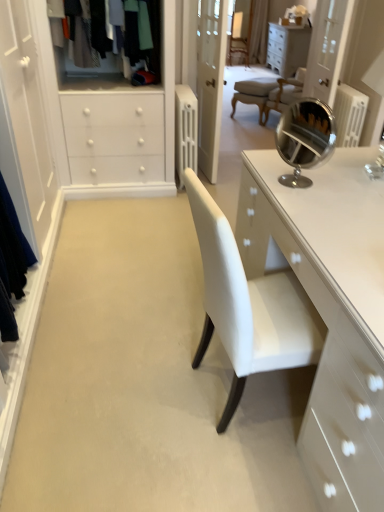
Question: Considering the positions of transparent glass door at upper right and polished chrome mirror at upper right in the image, is transparent glass door at upper right wider or thinner than polished chrome mirror at upper right?

Choices:
 (A) thin
 (B) wide

Answer: (B)

Question: Does point (334, 52) appear closer or farther from the camera than point (312, 164)?

Choices:
 (A) farther
 (B) closer

Answer: (A)

Question: Which object is positioned closest to the transparent glass door at upper right?

Choices:
 (A) polished chrome mirror at upper right
 (B) textured wool sweater at upper left
 (C) white glossy cabinet at upper center

Answer: (C)

Question: Based on their relative distances, which object is nearer to the transparent glass door at upper right?

Choices:
 (A) white glossy cabinet at upper center
 (B) polished chrome mirror at upper right
 (C) textured wool sweater at upper left

Answer: (A)